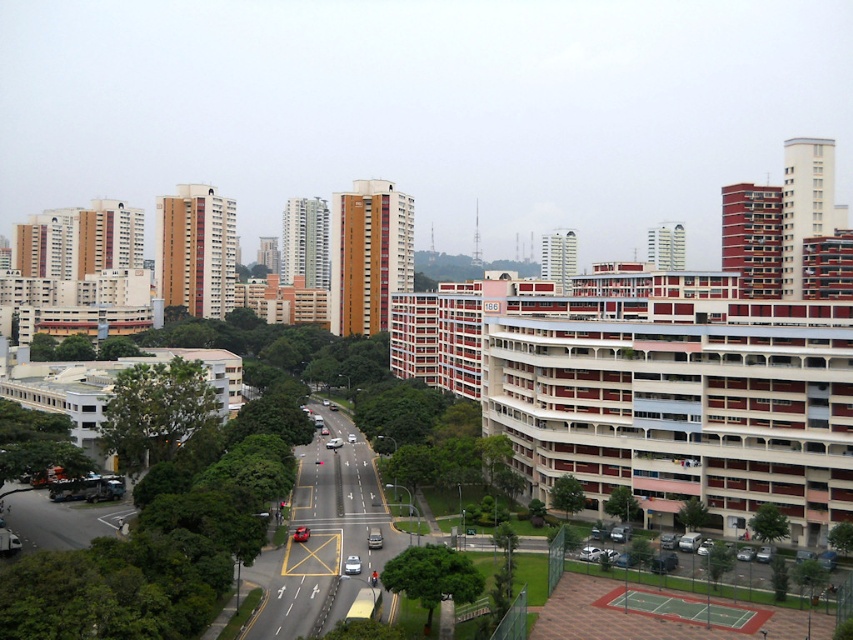
Question: Which of these objects is positioned closest to the matte red car at center?

Choices:
 (A) silver metallic car at center
 (B) shiny red car at center

Answer: (B)

Question: Is silver metallic car at center behind shiny red sedan at center?

Choices:
 (A) no
 (B) yes

Answer: (A)

Question: Where is matte red car at center located in relation to shiny red car at center in the image?

Choices:
 (A) right
 (B) left

Answer: (A)

Question: In this image, where is shiny red car at center located relative to shiny red sedan at center?

Choices:
 (A) above
 (B) below

Answer: (B)

Question: Which object appears closest to the camera in this image?

Choices:
 (A) matte red car at center
 (B) silver metallic car at center

Answer: (B)

Question: Among these points, which one is farthest from the camera?

Choices:
 (A) (335, 440)
 (B) (305, 536)
 (C) (372, 534)

Answer: (A)